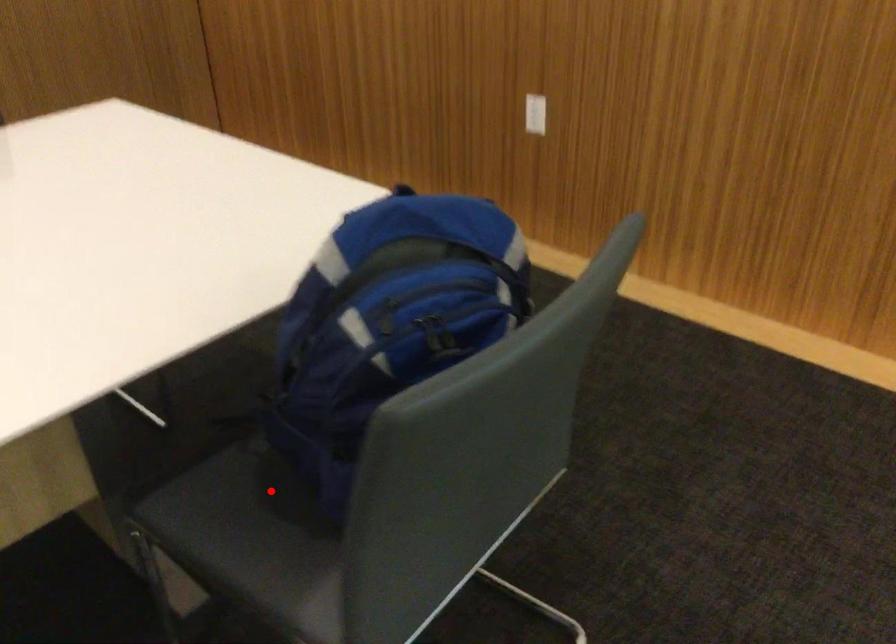
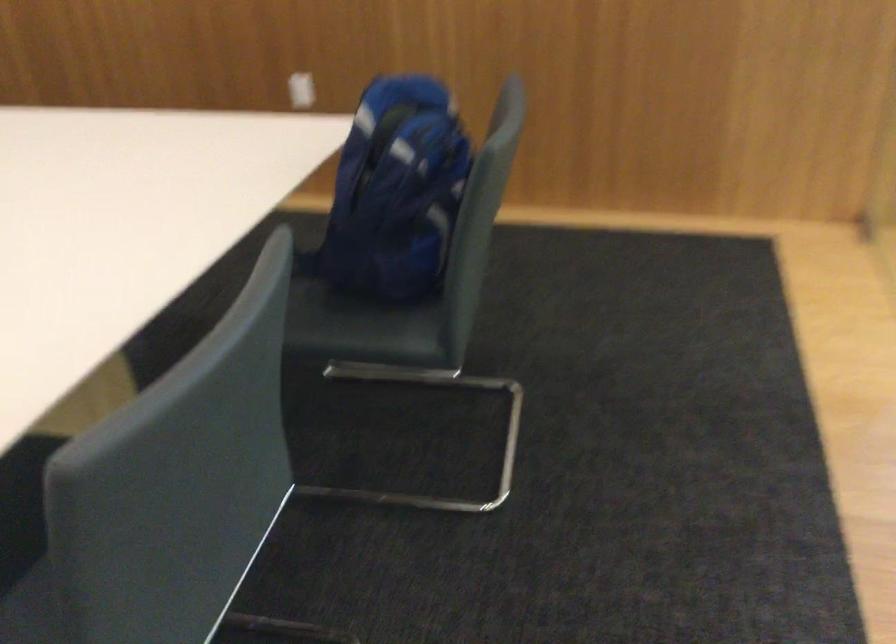
Question: I am providing you with two images of the same scene from different viewpoints. Image1 has a red point marked. In image2, the corresponding 3D location appears at what relative position? Reply with the corresponding letter.

Choices:
 (A) Closer
 (B) Farther

Answer: (B)